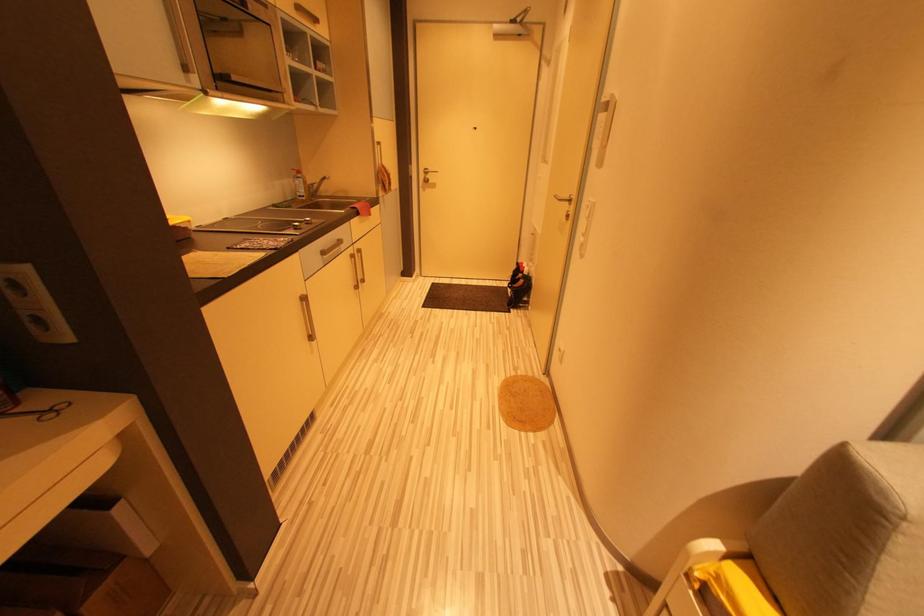
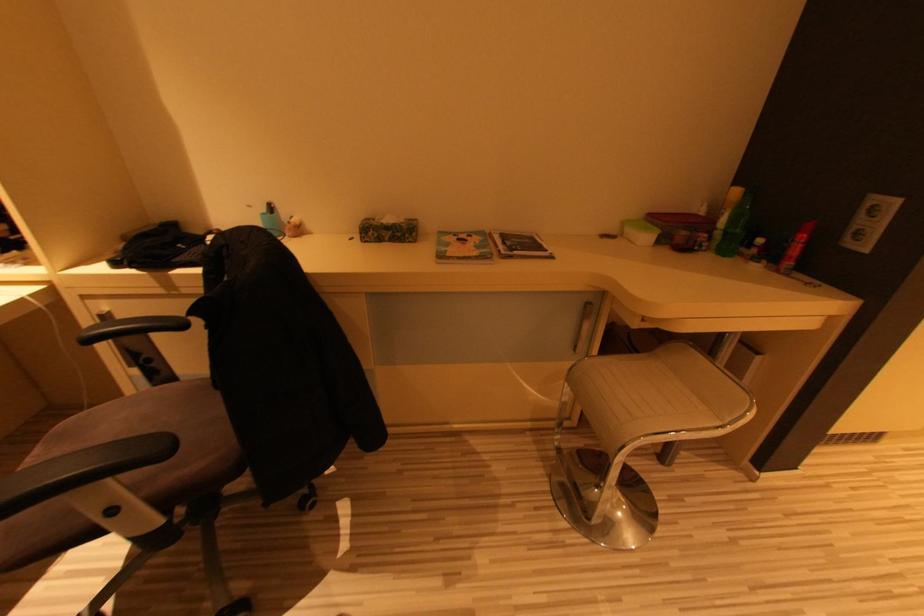
The first image is from the beginning of the video and the second image is from the end. How did the camera likely rotate when shooting the video?

The rotation direction of the camera is left-down.